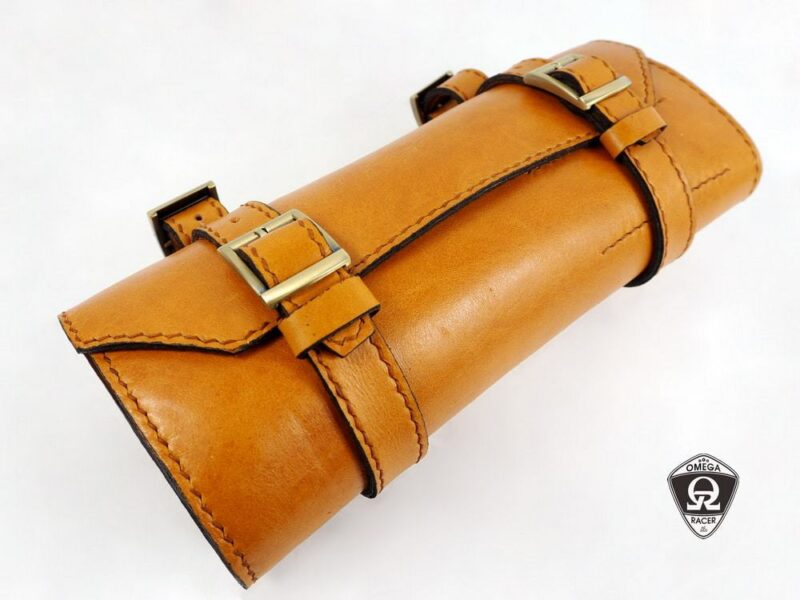
This screenshot has width=800, height=600. Identify the location of brown leather object. (474, 219).